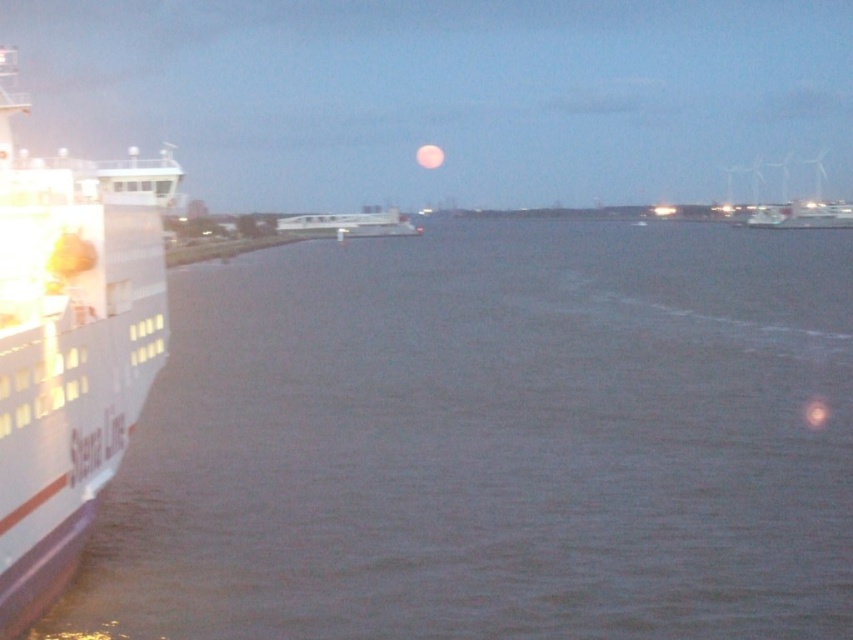
You are a harbor inspector checking vessel dimensions. The white glossy cruise ship at left and the white matte boat at center are both anchored in the harbor. According to your measurements, which vessel has a greater width?

The white glossy cruise ship at left is wider than the white matte boat at center according to the description.

You are a photographer planning to capture the sunset with both the white glossy cruise ship at left and the white matte boat at center in your frame. Which vessel should you focus on to ensure it appears more prominent in the photo?

The white glossy cruise ship at left should be focused on because it has a larger size compared to the white matte boat at center, making it more prominent in the photo.

You are standing at the waterfront and want to reach a specific location marked by point coordinates at point (310, 600). Given that your walking speed is 3 feet per second, how many seconds will it take you to reach that point?

The distance between you and point (310, 600) is 69.69 feet. At a walking speed of 3 feet per second, it will take 69.69 divided by 3 equals approximately 23.23 seconds to reach the point.